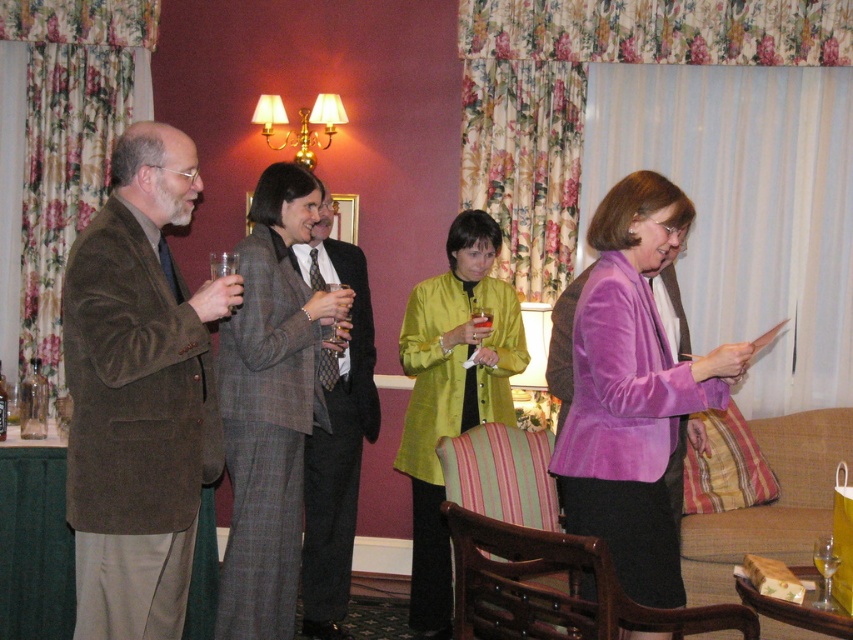
You are standing at the point marked by coordinates (473, 358) in the image. You want to approach the two men in the scene. Which direction should you move to reach them first?

Since the two men are 3.58 meters apart from the point marked by coordinates (473, 358), you should move towards the direction where they are closer. However, the exact direction isn

You are a photographer at the event and want to capture a photo where both the gray wool suit at center and the transparent plastic wine glass at center are clearly visible. Based on their positions, which object should you focus on first to ensure both are in focus?

The gray wool suit at center is below the transparent plastic wine glass at center, so you should focus on the transparent plastic wine glass at center first to ensure both are in focus.